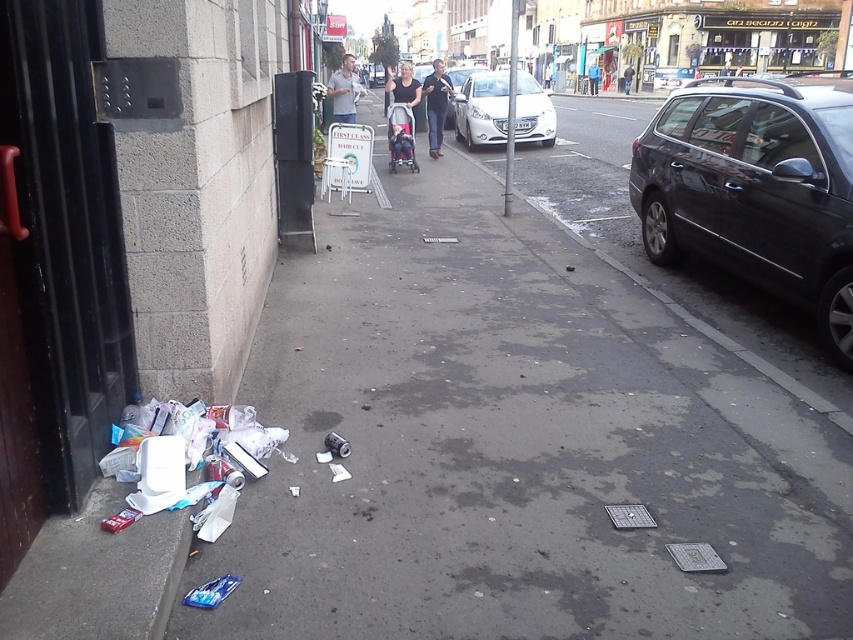
Question: Considering the real-world distances, which object is closest to the plastic bag at lower left?

Choices:
 (A) white glossy sedan at center
 (B) black glossy car at right

Answer: (B)

Question: Among these objects, which one is farthest from the camera?

Choices:
 (A) plastic bag at lower left
 (B) white glossy sedan at center
 (C) white paper at left
 (D) red fabric baby carriage at center

Answer: (B)

Question: Which object is closer to the camera taking this photo?

Choices:
 (A) white glossy sedan at center
 (B) plastic bag at lower left
 (C) red fabric baby carriage at center

Answer: (B)

Question: Observing the image, what is the correct spatial positioning of plastic bag at lower left in reference to red fabric baby carriage at center?

Choices:
 (A) above
 (B) below

Answer: (B)

Question: Considering the relative positions of plastic bag at lower left and red fabric baby carriage at center in the image provided, where is plastic bag at lower left located with respect to red fabric baby carriage at center?

Choices:
 (A) above
 (B) below

Answer: (B)

Question: Does black glossy car at right have a larger size compared to plastic bag at lower left?

Choices:
 (A) yes
 (B) no

Answer: (A)